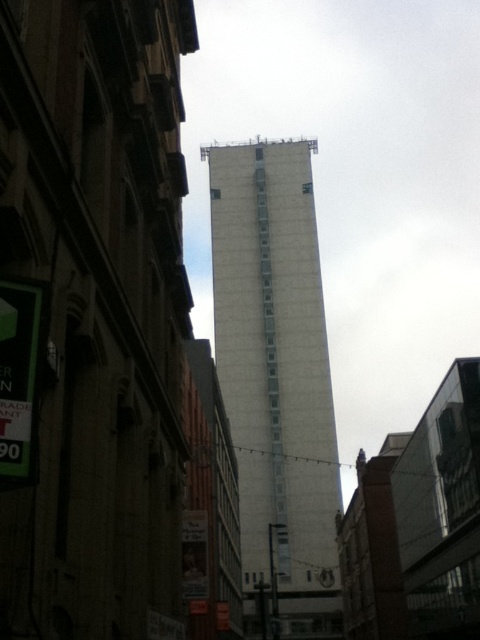
You are a city planner reviewing this urban layout. You need to determine which object occupies more space in the scene. Based on the image, which is bigger between the white concrete tower at center and the green plastic sign at left?

The white concrete tower at center is larger in size than the green plastic sign at left, so the white concrete tower at center occupies more space in the scene.

You are a city planner reviewing this urban layout. You need to determine if the green plastic sign at left is visible from the top of the white concrete tower at center. Based on their positions, can you confirm if the sign is below the tower?

The white concrete tower at center is above the green plastic sign at left, so yes, the sign is below the tower and would be visible from the top of the tower.